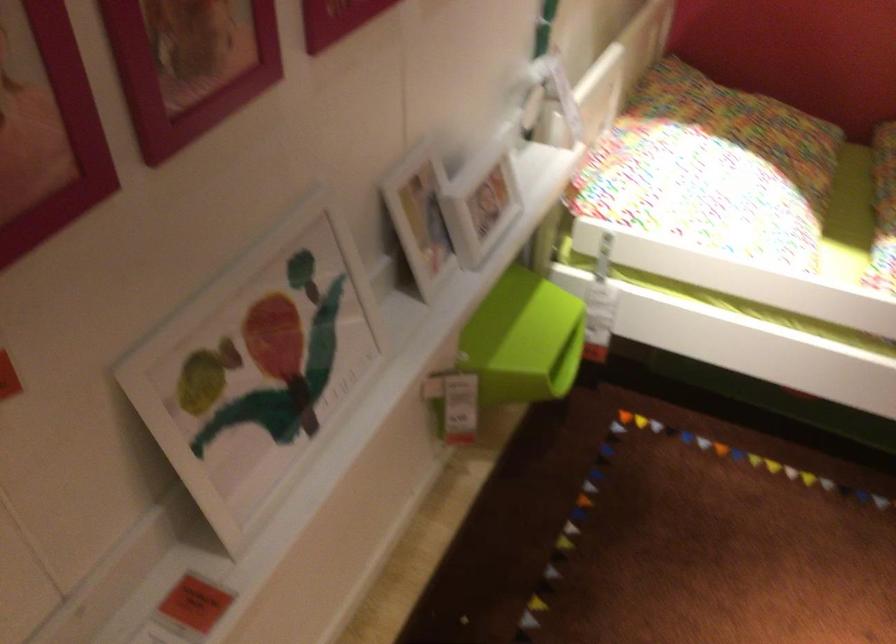
What are the coordinates of `small white picture frame` in the screenshot? It's located at (479, 200).